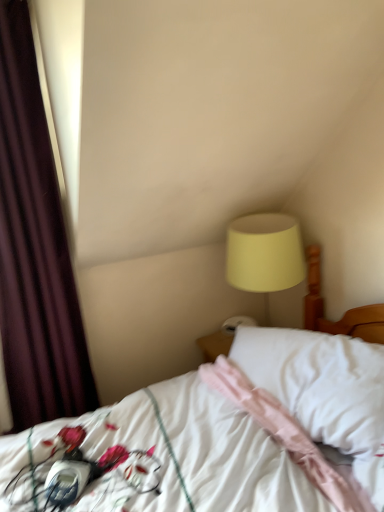
Looking at this image, in order to face matte yellow lampshade at upper right, should I rotate leftwards or rightwards?

Rotate your view right by about 9.633°.

Where is `pink fabric pillow at center`? pink fabric pillow at center is located at coordinates 319,382.

Is the depth of dark purple velvet curtain at left less than that of white satin bed at center?

No, it is behind white satin bed at center.

From a real-world perspective, is dark purple velvet curtain at left positioned above or below white satin bed at center?

dark purple velvet curtain at left is above white satin bed at center.

Is dark purple velvet curtain at left touching white satin bed at center?

dark purple velvet curtain at left and white satin bed at center are not in contact.

From the image's perspective, would you say dark purple velvet curtain at left is positioned over white satin bed at center?

Indeed, from the image's perspective, dark purple velvet curtain at left is shown above white satin bed at center.

Can you tell me how much white satin bed at center and dark purple velvet curtain at left differ in facing direction?

The facing directions of white satin bed at center and dark purple velvet curtain at left are 89.3 degrees apart.

Locate an element on the screen. Image resolution: width=384 pixels, height=512 pixels. curtain above the white satin bed at center (from the image's perspective) is located at coordinates (35, 248).

Is white satin bed at center directly adjacent to dark purple velvet curtain at left?

No, white satin bed at center is not in contact with dark purple velvet curtain at left.

Image resolution: width=384 pixels, height=512 pixels. I want to click on curtain above the matte yellow lampshade at upper right (from the image's perspective), so click(35, 248).

Looking at this image, is dark purple velvet curtain at left next to matte yellow lampshade at upper right?

No, dark purple velvet curtain at left is not next to matte yellow lampshade at upper right.

Which object is more forward, dark purple velvet curtain at left or matte yellow lampshade at upper right?

dark purple velvet curtain at left is closer to the camera.

Could you tell me if pink fabric pillow at center is facing dark purple velvet curtain at left?

No, pink fabric pillow at center is not turned towards dark purple velvet curtain at left.

In the image, is pink fabric pillow at center on the left side or the right side of dark purple velvet curtain at left?

In the image, pink fabric pillow at center appears on the right side of dark purple velvet curtain at left.

Is pink fabric pillow at center next to dark purple velvet curtain at left and touching it?

No, pink fabric pillow at center is not in contact with dark purple velvet curtain at left.

Looking at this image, between pink fabric pillow at center and dark purple velvet curtain at left, which one has larger width?

pink fabric pillow at center.

Which is more to the left, white satin bed at center or pink fabric pillow at center?

From the viewer's perspective, white satin bed at center appears more on the left side.

From a real-world perspective, is white satin bed at center located beneath pink fabric pillow at center?

Correct, in the physical world, white satin bed at center is lower than pink fabric pillow at center.

Where is `bed located below the pink fabric pillow at center (from the image's perspective)`? bed located below the pink fabric pillow at center (from the image's perspective) is located at coordinates (230, 433).

Considering the relative sizes of white satin bed at center and pink fabric pillow at center in the image provided, is white satin bed at center taller than pink fabric pillow at center?

Yes.

Find the location of `bed that appears in front of the matte yellow lampshade at upper right`. bed that appears in front of the matte yellow lampshade at upper right is located at coordinates (230, 433).

Which of these two, matte yellow lampshade at upper right or white satin bed at center, is thinner?

matte yellow lampshade at upper right is thinner.

Who is shorter, matte yellow lampshade at upper right or white satin bed at center?

matte yellow lampshade at upper right.

From a real-world perspective, is matte yellow lampshade at upper right positioned under white satin bed at center based on gravity?

Incorrect, from a real-world perspective, matte yellow lampshade at upper right is higher than white satin bed at center.

Considering the positions of objects matte yellow lampshade at upper right and dark purple velvet curtain at left in the image provided, who is more to the left, matte yellow lampshade at upper right or dark purple velvet curtain at left?

dark purple velvet curtain at left.

From a real-world perspective, is matte yellow lampshade at upper right below dark purple velvet curtain at left?

Yes.

Who is taller, matte yellow lampshade at upper right or dark purple velvet curtain at left?

With more height is dark purple velvet curtain at left.

Is matte yellow lampshade at upper right wider than dark purple velvet curtain at left?

Correct, the width of matte yellow lampshade at upper right exceeds that of dark purple velvet curtain at left.

Where is `bed below the dark purple velvet curtain at left (from the image's perspective)`? The image size is (384, 512). bed below the dark purple velvet curtain at left (from the image's perspective) is located at coordinates coord(230,433).

Locate an element on the screen. This screenshot has height=512, width=384. curtain behind the white satin bed at center is located at coordinates (35, 248).

Looking at the image, which one is located closer to white satin bed at center, pink fabric pillow at center or matte yellow lampshade at upper right?

pink fabric pillow at center lies closer to white satin bed at center than the other object.

Considering their positions, is white satin bed at center positioned closer to pink fabric pillow at center than matte yellow lampshade at upper right?

white satin bed at center is closer to pink fabric pillow at center.

From the image, which object appears to be nearer to dark purple velvet curtain at left, white satin bed at center or pink fabric pillow at center?

Among the two, white satin bed at center is located nearer to dark purple velvet curtain at left.

Based on their spatial positions, is matte yellow lampshade at upper right or dark purple velvet curtain at left closer to white satin bed at center?

The object closer to white satin bed at center is matte yellow lampshade at upper right.

From the image, which object appears to be nearer to pink fabric pillow at center, dark purple velvet curtain at left or white satin bed at center?

white satin bed at center is positioned closer to the anchor pink fabric pillow at center.

Based on their spatial positions, is white satin bed at center or dark purple velvet curtain at left closer to matte yellow lampshade at upper right?

white satin bed at center.

Considering their positions, is white satin bed at center positioned closer to pink fabric pillow at center than dark purple velvet curtain at left?

Among the two, white satin bed at center is located nearer to pink fabric pillow at center.

Looking at the image, which one is located closer to matte yellow lampshade at upper right, pink fabric pillow at center or white satin bed at center?

The object closer to matte yellow lampshade at upper right is pink fabric pillow at center.

This screenshot has height=512, width=384. Find the location of `bedside lamp between dark purple velvet curtain at left and pink fabric pillow at center from left to right`. bedside lamp between dark purple velvet curtain at left and pink fabric pillow at center from left to right is located at coordinates (264, 254).

This screenshot has height=512, width=384. Find the location of `pillow between white satin bed at center and matte yellow lampshade at upper right along the z-axis`. pillow between white satin bed at center and matte yellow lampshade at upper right along the z-axis is located at coordinates (319, 382).

Identify the location of curtain located between white satin bed at center and matte yellow lampshade at upper right in the depth direction. (35, 248).

Find the location of `bed between dark purple velvet curtain at left and pink fabric pillow at center from left to right`. bed between dark purple velvet curtain at left and pink fabric pillow at center from left to right is located at coordinates (230, 433).